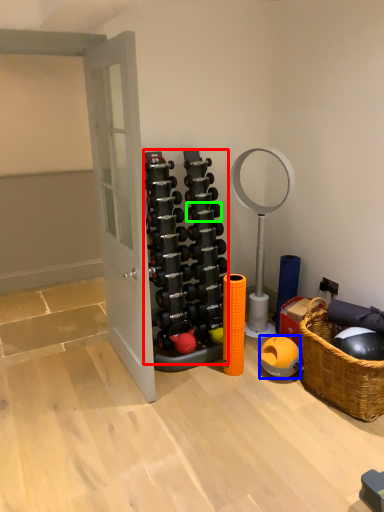
Question: Estimate the real-world distances between objects in this image. Which object is closer to dumbbell (highlighted by a red box), dumbbell (highlighted by a blue box) or dumbbell (highlighted by a green box)?

Choices:
 (A) dumbbell
 (B) dumbbell

Answer: (B)